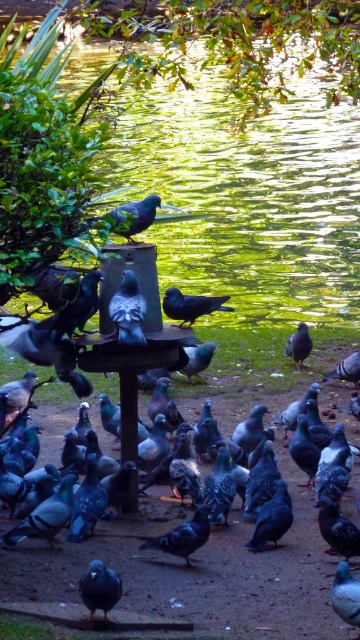
Question: Can you confirm if shiny metallic pigeon at center is smaller than matte gray pigeon at center-right?

Choices:
 (A) yes
 (B) no

Answer: (A)

Question: Which object is the farthest from the matte gray pigeon at lower left?

Choices:
 (A) white glossy pigeon at lower right
 (B) metallic blue bird at center
 (C) shiny metallic pigeon at lower left

Answer: (A)

Question: Does blue glossy pigeon at lower center have a larger size compared to shiny black bird at center?

Choices:
 (A) no
 (B) yes

Answer: (A)

Question: Can you confirm if shiny metallic pigeon at center is bigger than shiny black bird at center?

Choices:
 (A) no
 (B) yes

Answer: (A)

Question: Which of the following is the farthest from the observer?

Choices:
 (A) shiny black pigeon at center
 (B) green glossy bird at center

Answer: (B)

Question: Which of the following is the farthest from the observer?

Choices:
 (A) matte gray pigeon at center-right
 (B) green glossy bird at center
 (C) shiny metallic pigeon at lower right

Answer: (A)